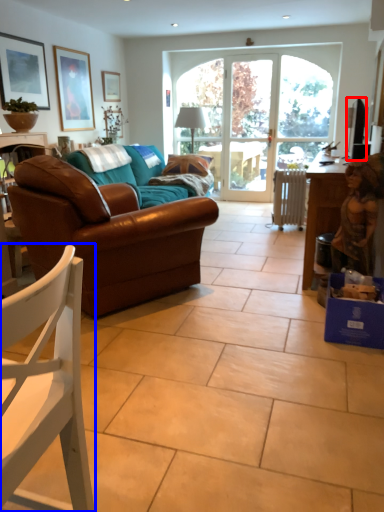
Question: Which object appears farthest to the camera in this image, television (highlighted by a red box) or chair (highlighted by a blue box)?

Choices:
 (A) television
 (B) chair

Answer: (A)